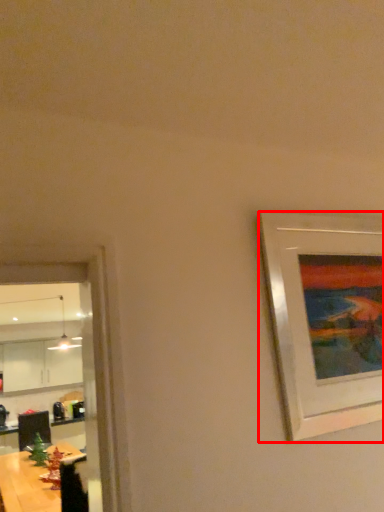
Question: Observing the image, what is the correct spatial positioning of picture frame (annotated by the red box) in reference to table?

Choices:
 (A) right
 (B) left

Answer: (A)